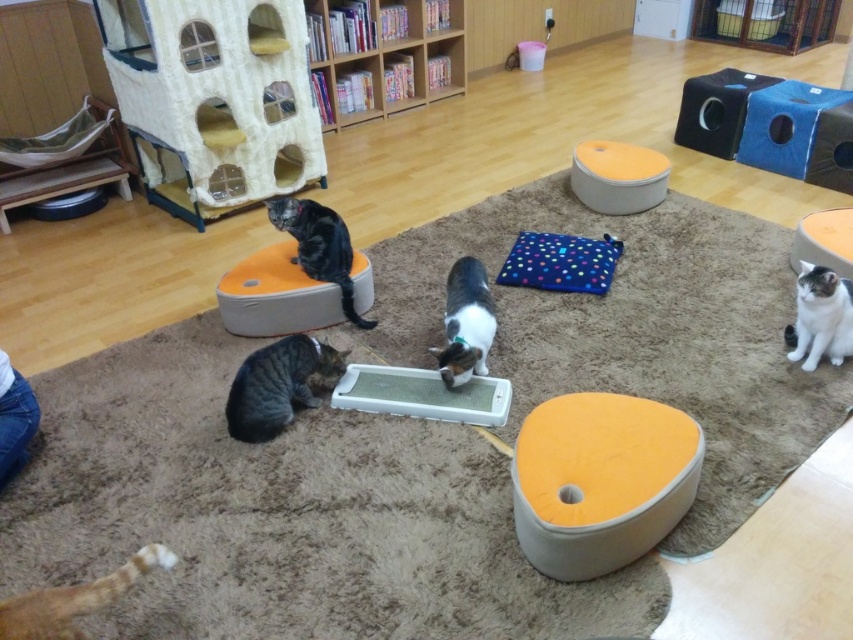
Measure the distance from orange fur paw at lower left to white and gray fur cat at lower right.

orange fur paw at lower left and white and gray fur cat at lower right are 2.12 meters apart.

Does orange fur paw at lower left have a greater height compared to white and gray fur cat at lower right?

Incorrect, orange fur paw at lower left's height is not larger of white and gray fur cat at lower right's.

Who is more distant from viewer, (18, 632) or (845, 280)?

Positioned behind is point (845, 280).

What are the coordinates of `orange fur paw at lower left` in the screenshot? It's located at (74, 600).

Does white-gray fur cat at center have a smaller size compared to white and gray fur cat at lower right?

Actually, white-gray fur cat at center might be larger than white and gray fur cat at lower right.

Where is `white-gray fur cat at center`? white-gray fur cat at center is located at coordinates (465, 323).

Does point (468, 342) come behind point (817, 273)?

Yes, point (468, 342) is behind point (817, 273).

In order to click on white-gray fur cat at center in this screenshot , I will do `click(465, 323)`.

Does orange fabric cat bed at center have a larger size compared to tabby fur cat at lower left?

Indeed, orange fabric cat bed at center has a larger size compared to tabby fur cat at lower left.

Which is behind, point (285, 552) or point (270, 369)?

The point (270, 369) is behind.

Is point (61, 484) positioned in front of point (253, 412)?

That is True.

Image resolution: width=853 pixels, height=640 pixels. Find the location of `orange fabric cat bed at center`. orange fabric cat bed at center is located at coordinates (282, 515).